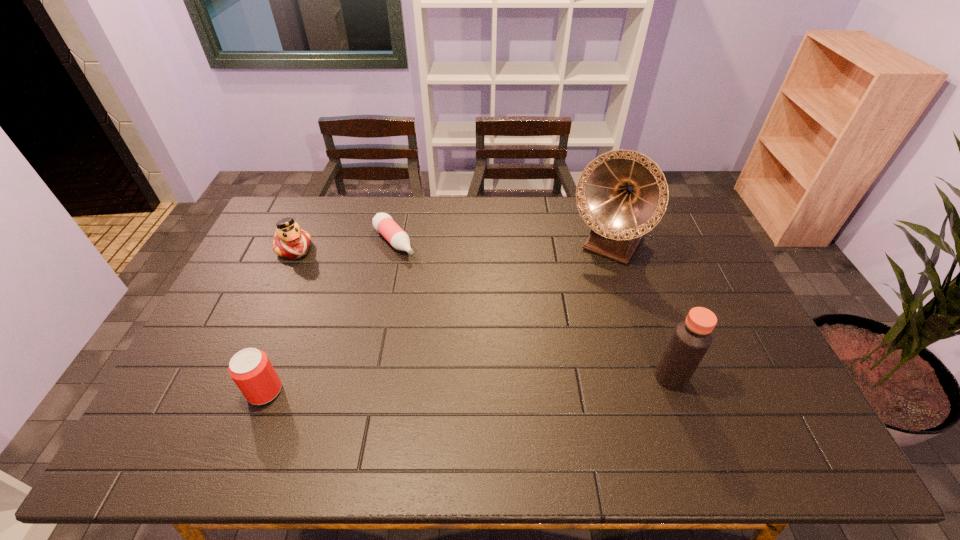
What are the coordinates of `vacant space on the desktop that is between the beer can and the second tallest object and is positioned on the horn of the tallest object` in the screenshot? It's located at (520, 382).

Locate an element on the screen. free space on the desktop that is between the beer can and the vinegar and is positioned on the face of the duck is located at coordinates (428, 386).

This screenshot has width=960, height=540. Identify the location of free space on the desktop that is between the beer can and the vinegar and is positioned with the cap open on the third object from left to right. (527, 382).